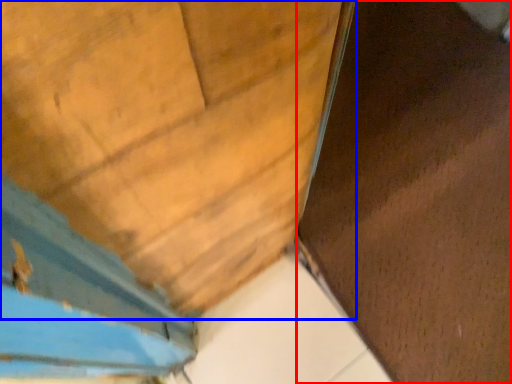
Question: Among these objects, which one is farthest to the camera, plywood (highlighted by a red box) or door (highlighted by a blue box)?

Choices:
 (A) plywood
 (B) door

Answer: (A)